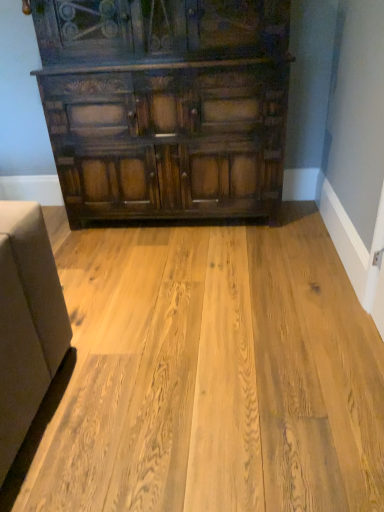
Question: From the image's perspective, is natural wood floor at center above dark wood cabinet at upper center?

Choices:
 (A) yes
 (B) no

Answer: (B)

Question: Is natural wood floor at center smaller than dark wood cabinet at upper center?

Choices:
 (A) yes
 (B) no

Answer: (A)

Question: Considering the relative positions of natural wood floor at center and dark wood cabinet at upper center in the image provided, is natural wood floor at center behind dark wood cabinet at upper center?

Choices:
 (A) no
 (B) yes

Answer: (A)

Question: From a real-world perspective, is natural wood floor at center on dark wood cabinet at upper center?

Choices:
 (A) no
 (B) yes

Answer: (A)

Question: Does natural wood floor at center have a greater width compared to dark wood cabinet at upper center?

Choices:
 (A) no
 (B) yes

Answer: (B)

Question: Does natural wood floor at center come in front of dark wood cabinet at upper center?

Choices:
 (A) no
 (B) yes

Answer: (B)

Question: Is natural wood floor at center located within dark wood cabinet at upper center?

Choices:
 (A) no
 (B) yes

Answer: (A)

Question: Is the position of dark wood cabinet at upper center more distant than that of natural wood floor at center?

Choices:
 (A) no
 (B) yes

Answer: (B)

Question: Is dark wood cabinet at upper center not within natural wood floor at center?

Choices:
 (A) no
 (B) yes

Answer: (B)

Question: Is dark wood cabinet at upper center positioned with its back to natural wood floor at center?

Choices:
 (A) no
 (B) yes

Answer: (A)

Question: From the image's perspective, would you say dark wood cabinet at upper center is positioned over natural wood floor at center?

Choices:
 (A) no
 (B) yes

Answer: (B)

Question: From a real-world perspective, does dark wood cabinet at upper center stand above natural wood floor at center?

Choices:
 (A) no
 (B) yes

Answer: (B)

Question: Which is correct: natural wood floor at center is inside dark wood cabinet at upper center, or outside of it?

Choices:
 (A) outside
 (B) inside

Answer: (A)